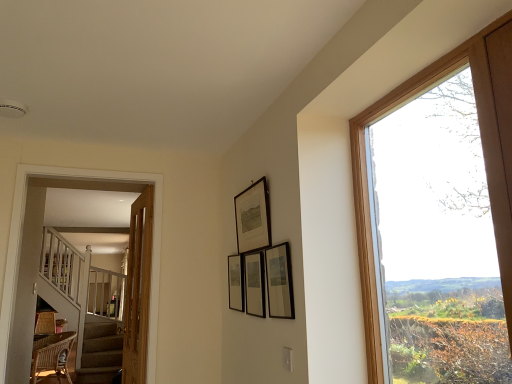
Question: Considering the relative positions of white wooden staircase at left and wooden framed print at upper center, arranged as the third picture frame when viewed from the back, in the image provided, is white wooden staircase at left to the left of wooden framed print at upper center, arranged as the third picture frame when viewed from the back, from the viewer's perspective?

Choices:
 (A) no
 (B) yes

Answer: (B)

Question: Is wooden framed print at upper center, arranged as the third picture frame when viewed from the back, a part of white wooden staircase at left?

Choices:
 (A) yes
 (B) no

Answer: (B)

Question: Is white wooden staircase at left closer to the viewer compared to wooden framed print at upper center, arranged as the third picture frame when viewed from the back?

Choices:
 (A) no
 (B) yes

Answer: (A)

Question: Is white wooden staircase at left further to camera compared to wooden framed print at upper center, which appears as the 2th picture frame when viewed from the front?

Choices:
 (A) no
 (B) yes

Answer: (B)

Question: From a real-world perspective, does white wooden staircase at left stand above wooden framed print at upper center, which appears as the 2th picture frame when viewed from the front?

Choices:
 (A) yes
 (B) no

Answer: (B)

Question: Considering the relative positions of clear glass window at right and wicker chair at lower left in the image provided, is clear glass window at right to the left or to the right of wicker chair at lower left?

Choices:
 (A) left
 (B) right

Answer: (B)

Question: Is clear glass window at right taller or shorter than wicker chair at lower left?

Choices:
 (A) tall
 (B) short

Answer: (A)

Question: From the image's perspective, is clear glass window at right above or below wicker chair at lower left?

Choices:
 (A) below
 (B) above

Answer: (B)

Question: In terms of size, does clear glass window at right appear bigger or smaller than wicker chair at lower left?

Choices:
 (A) big
 (B) small

Answer: (B)

Question: Based on their sizes in the image, would you say wicker chair at lower left is bigger or smaller than matte black picture frame at upper center, arranged as the 4th picture frame when viewed from the back?

Choices:
 (A) small
 (B) big

Answer: (B)

Question: From the image's perspective, relative to matte black picture frame at upper center, arranged as the 1th picture frame when viewed from the front, is wicker chair at lower left above or below?

Choices:
 (A) below
 (B) above

Answer: (A)

Question: In the image, is wicker chair at lower left on the left side or the right side of matte black picture frame at upper center, arranged as the 4th picture frame when viewed from the back?

Choices:
 (A) right
 (B) left

Answer: (B)

Question: Does point (45, 350) appear closer or farther from the camera than point (280, 266)?

Choices:
 (A) closer
 (B) farther

Answer: (B)

Question: Looking at their shapes, would you say matte black picture frame at center, the 3th picture frame viewed from the front, is wider or thinner than clear glass window at right?

Choices:
 (A) wide
 (B) thin

Answer: (B)

Question: Looking at the image, does matte black picture frame at center, which appears as the 2th picture frame when viewed from the back, seem bigger or smaller compared to clear glass window at right?

Choices:
 (A) small
 (B) big

Answer: (A)